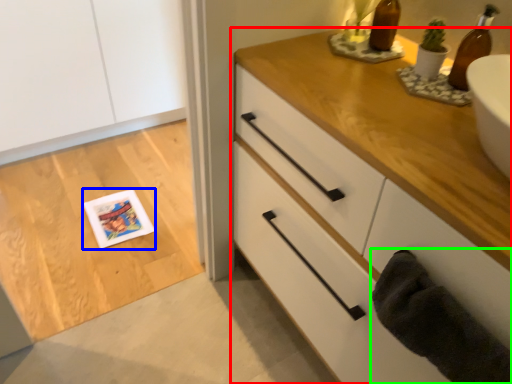
Question: Considering the real-world distances, which object is farthest from chest of drawers (highlighted by a red box)? postcard (highlighted by a blue box) or bath towel (highlighted by a green box)?

Choices:
 (A) postcard
 (B) bath towel

Answer: (A)